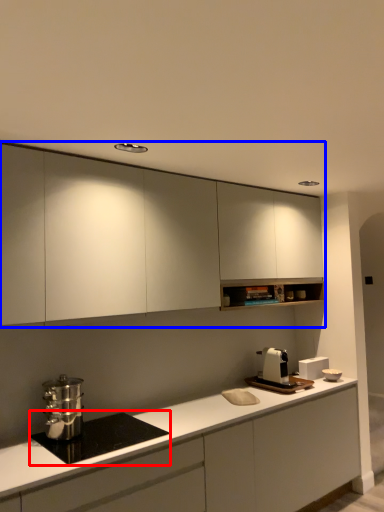
Question: Which point is further to the camera, home appliance (highlighted by a red box) or cabinetry (highlighted by a blue box)?

Choices:
 (A) home appliance
 (B) cabinetry

Answer: (B)